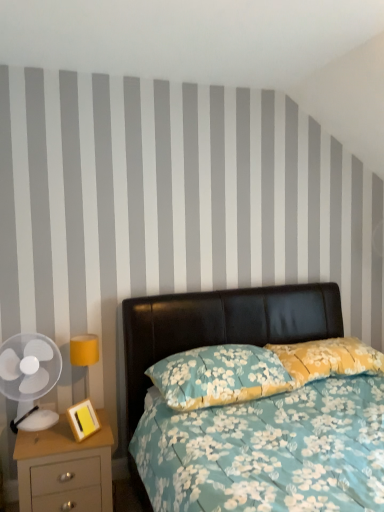
At what (x,y) coordinates should I click in order to perform the action: click on vacant space underneath transparent plastic fan at left (from a real-world perspective). Please return your answer as a coordinate pair (x, y). The width and height of the screenshot is (384, 512). Looking at the image, I should click on (43, 420).